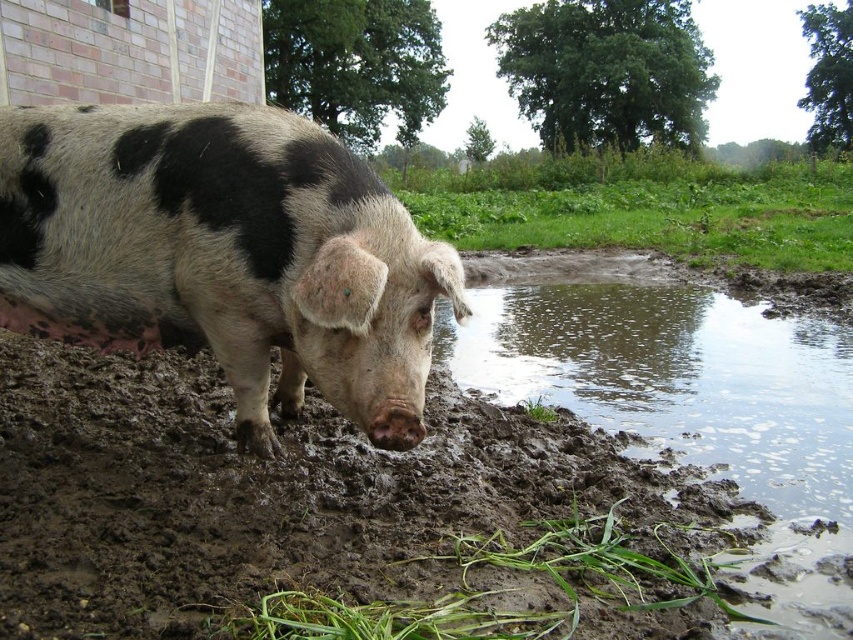
You are a farmer checking on your animals. You see the speckled fur pig at lower left and the muddy water at lower right. Which object is closer to the brick building in the background?

The speckled fur pig at lower left is closer to the brick building in the background because it is positioned to the left of the muddy water at lower right, and the brick building is also on the left side of the frame.

You are a farmer checking the area near the pig. You need to place a fence post exactly at the location marked by the brown wet mud at lower center. What are the coordinates where you should place the post?

The coordinates for the brown wet mud at lower center are 0.809 in the x direction and 0.390 in the y direction.

You are a photographer trying to capture a clear shot of the speckled fur pig at lower left and the green grass at center. Which object should you focus on first to ensure both are in focus?

You should focus on the speckled fur pig at lower left first because it is closer to the viewer than the green grass at center, so adjusting focus from near to far will help both be in focus.